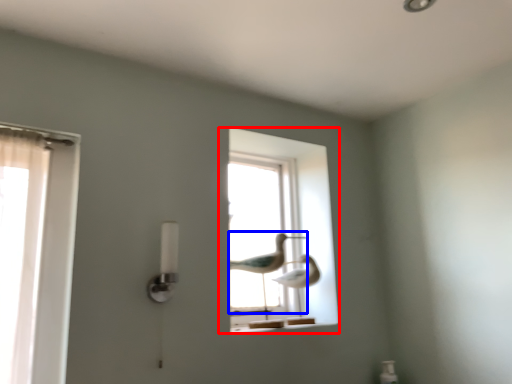
Question: Among these objects, which one is farthest to the camera, window (highlighted by a red box) or bird (highlighted by a blue box)?

Choices:
 (A) window
 (B) bird

Answer: (A)